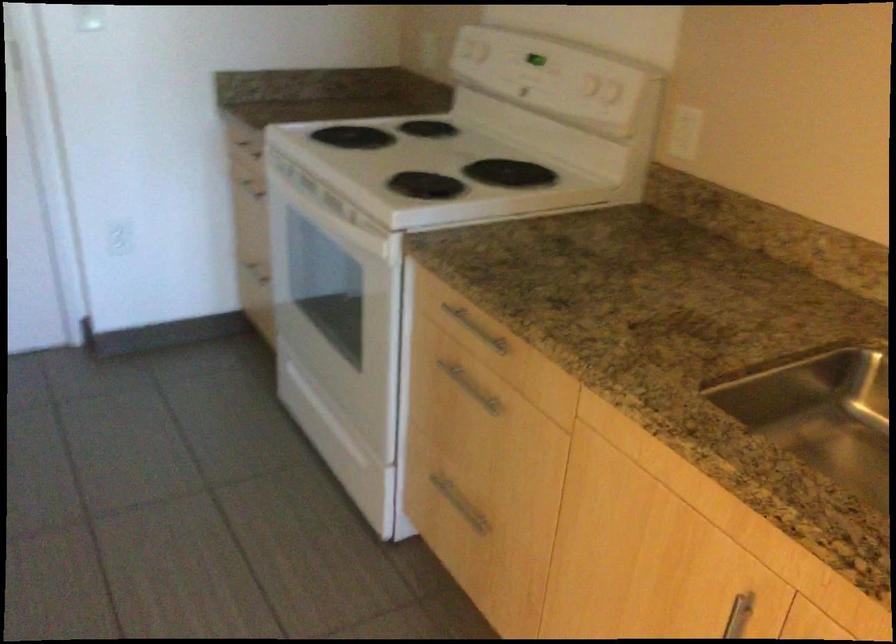
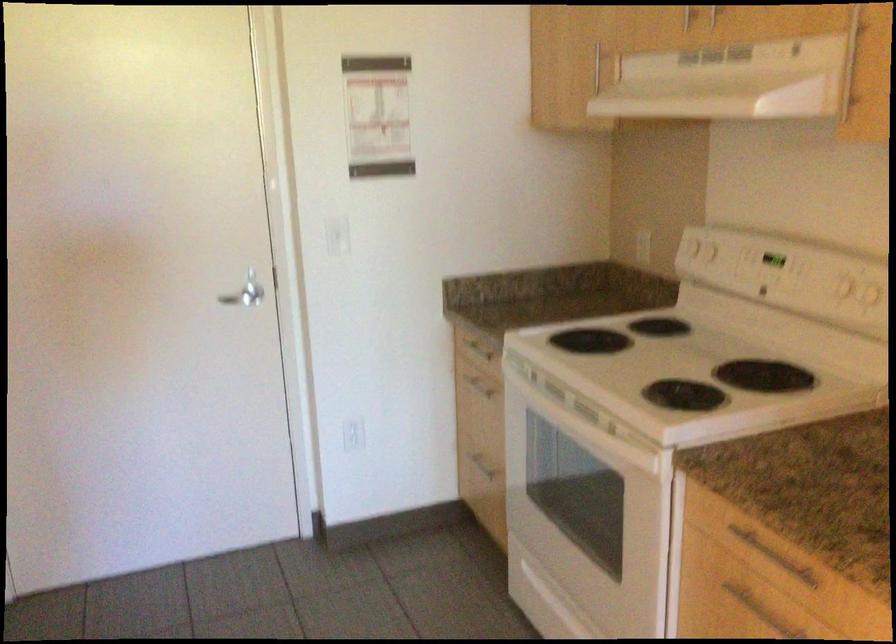
Question: The first image is from the beginning of the video and the second image is from the end. How did the camera likely rotate when shooting the video?

Choices:
 (A) Left
 (B) Right
 (C) Up
 (D) Down

Answer: (C)